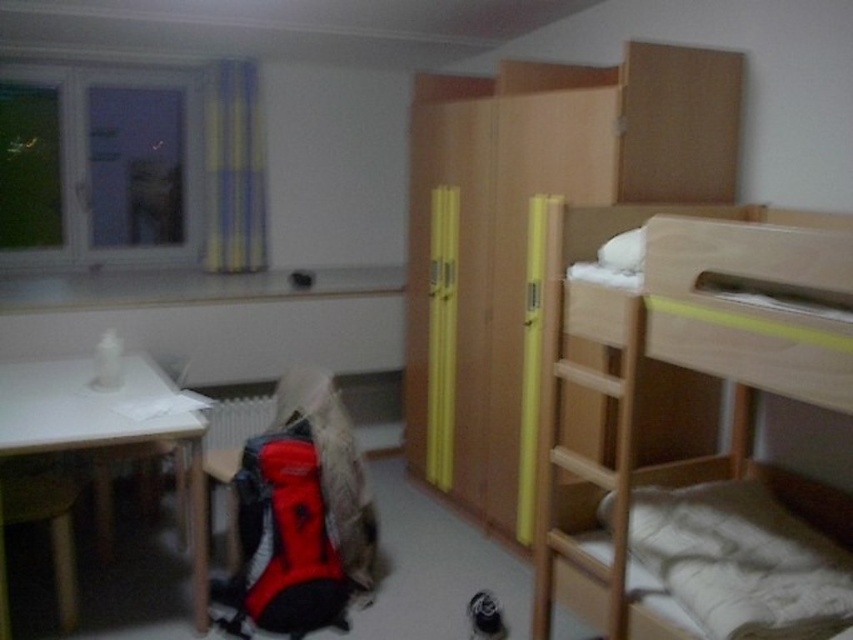
Between light wood bunk bed at right and white matte table at left, which one appears on the left side from the viewer's perspective?

white matte table at left

Can you confirm if light wood bunk bed at right is bigger than white matte table at left?

Correct, light wood bunk bed at right is larger in size than white matte table at left.

This screenshot has width=853, height=640. Find the location of `light wood bunk bed at right`. light wood bunk bed at right is located at coordinates (672, 388).